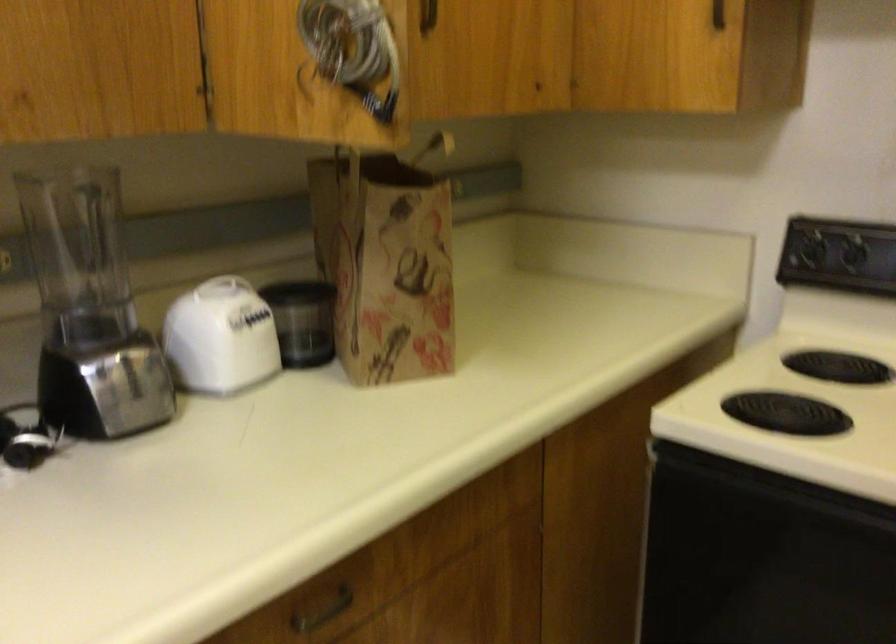
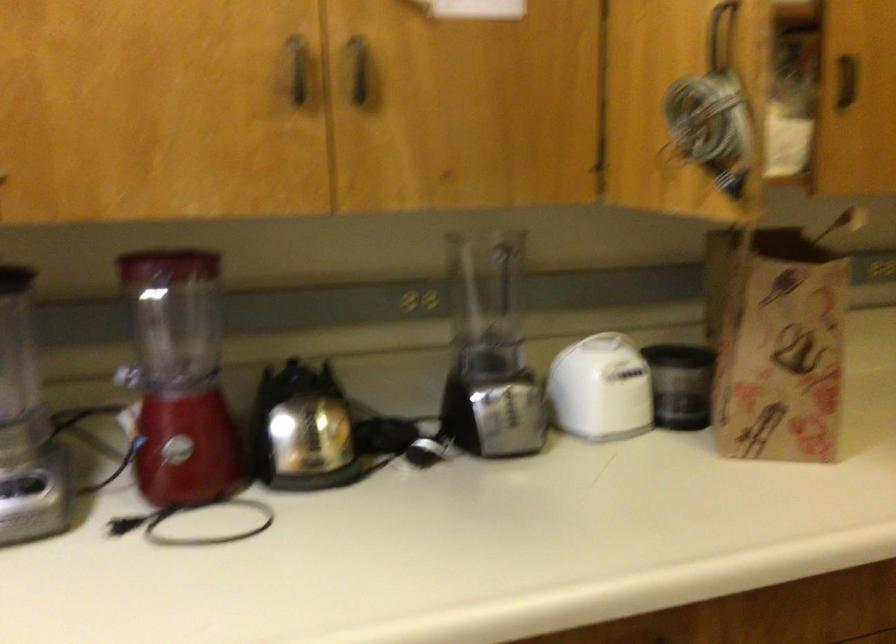
Question: The first image is from the beginning of the video and the second image is from the end. How did the camera likely rotate when shooting the video?

Choices:
 (A) Left
 (B) Right
 (C) Up
 (D) Down

Answer: (A)